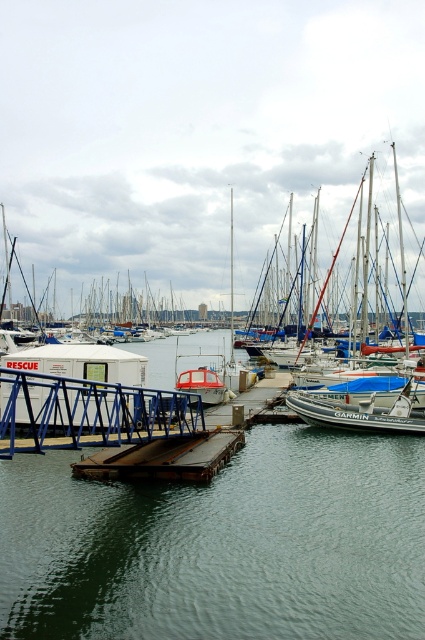
Question: Does green water at center come behind rusty metal dock at center?

Choices:
 (A) no
 (B) yes

Answer: (A)

Question: Among these points, which one is farthest from the camera?

Choices:
 (A) (266, 628)
 (B) (175, 465)

Answer: (B)

Question: Is green water at center positioned behind rusty metal dock at center?

Choices:
 (A) no
 (B) yes

Answer: (A)

Question: Is green water at center positioned behind rusty metal dock at center?

Choices:
 (A) no
 (B) yes

Answer: (A)

Question: Which point appears farthest from the camera in this image?

Choices:
 (A) (116, 563)
 (B) (244, 412)

Answer: (B)

Question: Which object is farther from the camera taking this photo?

Choices:
 (A) green water at center
 (B) rusty metal dock at center

Answer: (B)